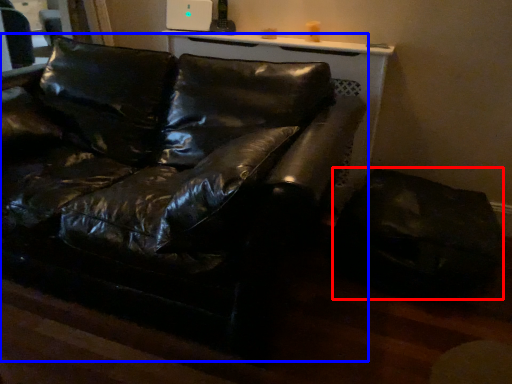
Question: Which object appears closest to the camera in this image, swivel chair (highlighted by a red box) or studio couch (highlighted by a blue box)?

Choices:
 (A) swivel chair
 (B) studio couch

Answer: (B)